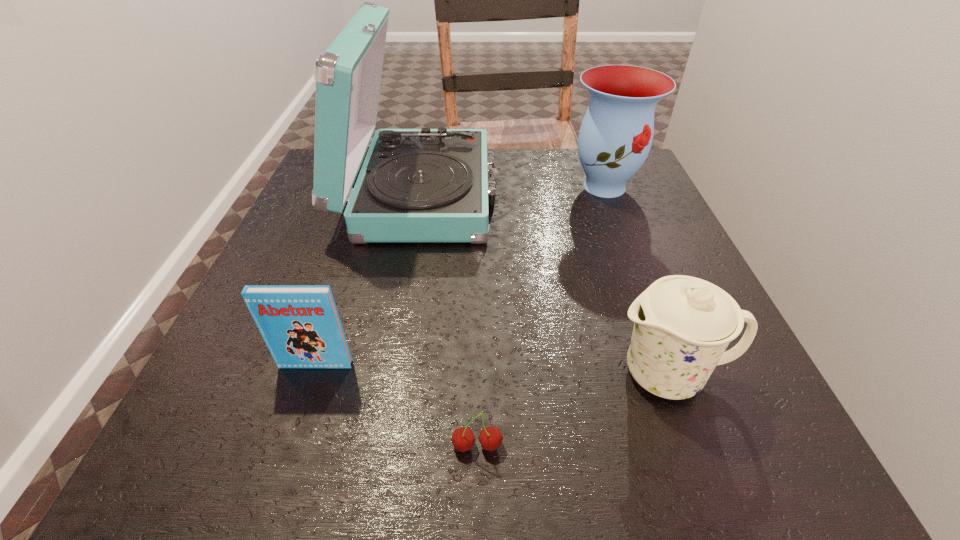
This screenshot has height=540, width=960. Find the location of `free space between the nearest object and the record player`. free space between the nearest object and the record player is located at coordinates (449, 320).

In order to click on empty space that is in between the book and the chinaware in this screenshot , I will do `click(492, 369)`.

Locate an element on the screen. The image size is (960, 540). vacant space that's between the tallest object and the vase is located at coordinates (513, 190).

At what (x,y) coordinates should I click in order to perform the action: click on blank region between the vase and the book. Please return your answer as a coordinate pair (x, y). Looking at the image, I should click on (460, 275).

I want to click on empty space that is in between the vase and the chinaware, so click(x=636, y=280).

Where is `free space between the book and the vase`? free space between the book and the vase is located at coordinates (460, 275).

Locate an element on the screen. The image size is (960, 540). vacant area that lies between the nearest object and the vase is located at coordinates (540, 316).

The width and height of the screenshot is (960, 540). I want to click on object that is the closest one to the shortest object, so click(x=683, y=324).

This screenshot has height=540, width=960. Find the location of `object that is the fourth nearest to the chinaware`. object that is the fourth nearest to the chinaware is located at coordinates (300, 324).

In order to click on free spot that satisfies the following two spatial constraints: 1. on the spout of the chinaware; 2. on the surface of the shortest object in this screenshot , I will do `click(695, 446)`.